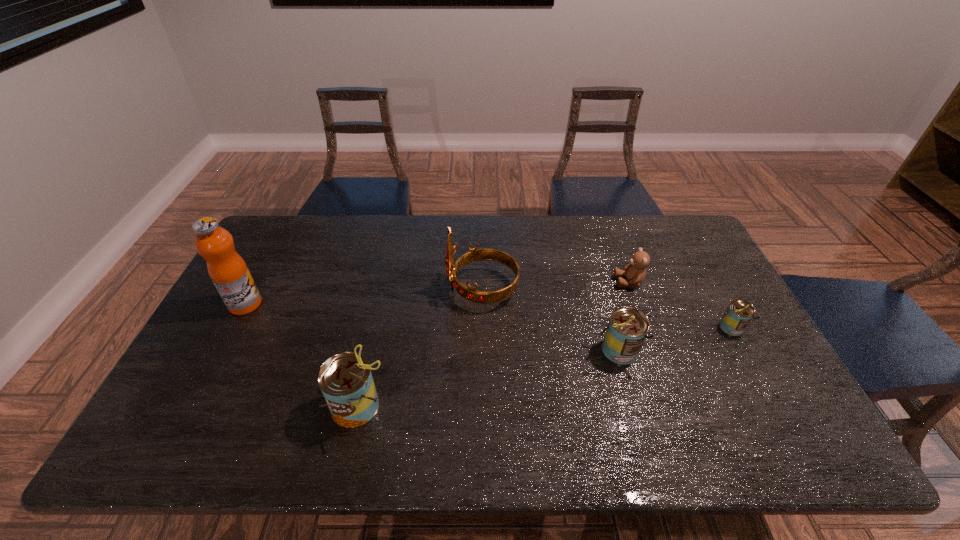
Image resolution: width=960 pixels, height=540 pixels. Find the location of `the second object from left to right`. the second object from left to right is located at coordinates (345, 379).

Identify the location of the nearest can. The height and width of the screenshot is (540, 960). (345, 379).

This screenshot has width=960, height=540. I want to click on the third shortest object, so click(x=627, y=329).

Where is `the second tallest can`? The height and width of the screenshot is (540, 960). the second tallest can is located at coordinates (627, 329).

Where is `the shortest can`? the shortest can is located at coordinates (738, 314).

Identify the location of the rightmost can. (738, 314).

Find the location of a particular element. tiara is located at coordinates (469, 293).

This screenshot has height=540, width=960. Identify the location of fruit juice. (227, 269).

Where is `the leftmost object`? The height and width of the screenshot is (540, 960). the leftmost object is located at coordinates (227, 269).

You are a GUI agent. You are given a task and a screenshot of the screen. Output one action in this format:
    pyautogui.click(x=<x>, y=<y>)
    Task: Click on the teddy bear
    This screenshot has height=540, width=960.
    Given the screenshot: What is the action you would take?
    pyautogui.click(x=635, y=272)